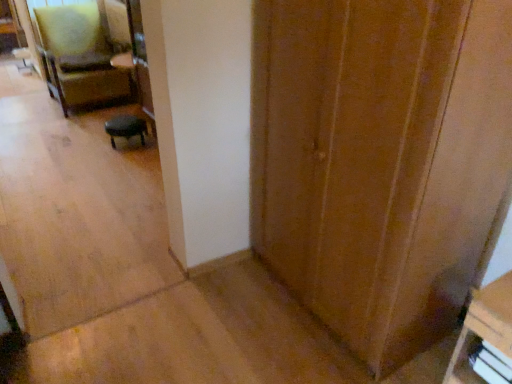
Where is `vacant space to the left of wooden door at center`? The height and width of the screenshot is (384, 512). vacant space to the left of wooden door at center is located at coordinates [x=223, y=318].